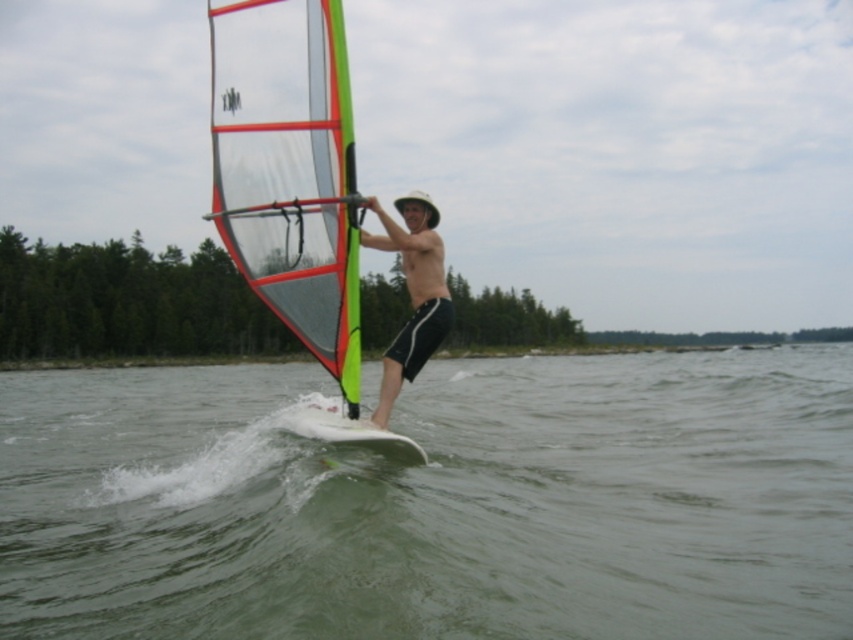
You are a photographer trying to capture the windsurfer. You have a camera with a zoom lens that can focus on objects up to 10 meters away. The transparent plastic sail at center and the matte black shorts at center are both in your viewfinder. Which object will appear bigger in your photo?

The transparent plastic sail at center is larger in size than the matte black shorts at center, so it will appear bigger in the photo.

You are a photographer trying to capture the windsurfer from above. You want to ensure the transparent plastic sail at center and the white smooth surfboard at center are both visible in your shot. Based on their positions, which object is covering part of the other?

The transparent plastic sail at center is positioned over the white smooth surfboard at center, so the sail is covering part of the surfboard.